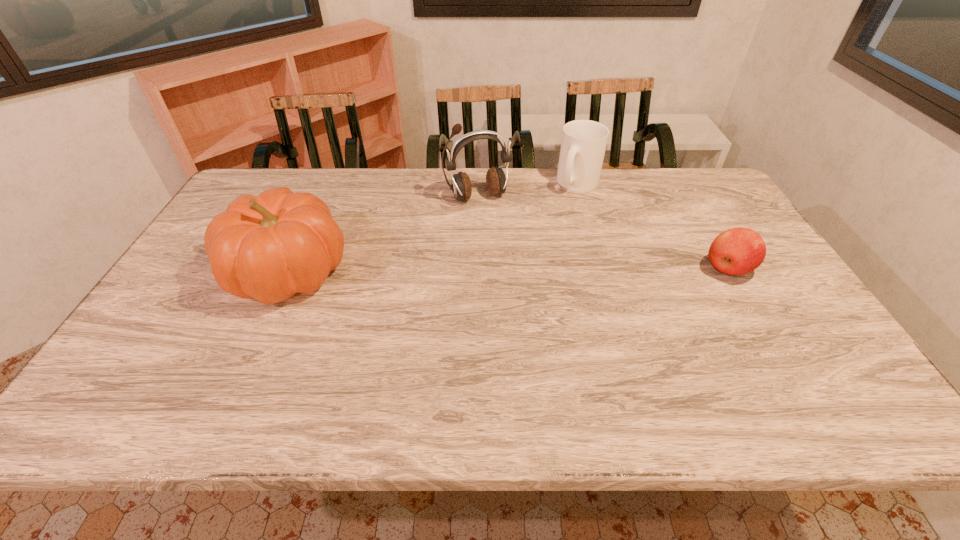
Where is `free space at the right edge`? Image resolution: width=960 pixels, height=540 pixels. free space at the right edge is located at coordinates (739, 279).

Locate an element on the screen. vacant space at the far right corner is located at coordinates (683, 180).

Image resolution: width=960 pixels, height=540 pixels. In order to click on free space between the earphone and the leftmost object in this screenshot , I will do `click(383, 234)`.

You are a GUI agent. You are given a task and a screenshot of the screen. Output one action in this format:
    pyautogui.click(x=<x>, y=<y>)
    Task: Click on the free spot between the pumpkin and the second object from left to right
    The width and height of the screenshot is (960, 540).
    Given the screenshot: What is the action you would take?
    [383, 234]

You are a GUI agent. You are given a task and a screenshot of the screen. Output one action in this format:
    pyautogui.click(x=<x>, y=<y>)
    Task: Click on the vacant point located between the leftmost object and the mug
    
    Given the screenshot: What is the action you would take?
    click(x=433, y=227)

In order to click on free space between the shortest object and the third object from right to left in this screenshot , I will do `click(603, 233)`.

The height and width of the screenshot is (540, 960). Find the location of `free space between the mug and the pumpkin`. free space between the mug and the pumpkin is located at coordinates (433, 227).

You are a GUI agent. You are given a task and a screenshot of the screen. Output one action in this format:
    pyautogui.click(x=<x>, y=<y>)
    Task: Click on the unoccupied position between the earphone and the shortest object
    
    Given the screenshot: What is the action you would take?
    pyautogui.click(x=603, y=233)

Identify the location of free spot between the earphone and the leftmost object. The height and width of the screenshot is (540, 960). (383, 234).

This screenshot has width=960, height=540. I want to click on empty location between the third object from left to right and the leftmost object, so [433, 227].